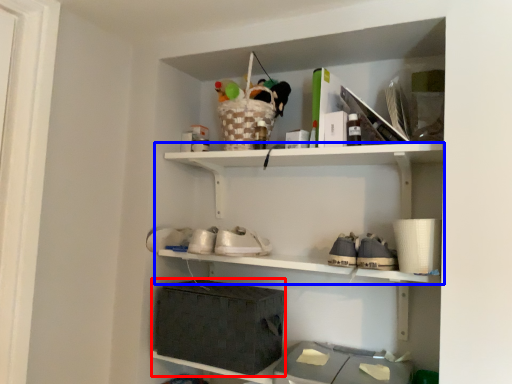
Question: Which object is further to the camera taking this photo, storage box (highlighted by a red box) or shelf (highlighted by a blue box)?

Choices:
 (A) storage box
 (B) shelf

Answer: (A)